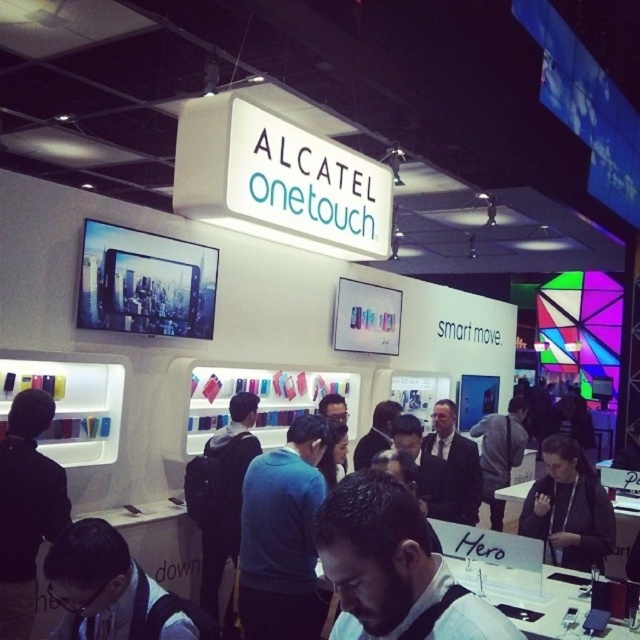
Question: Which of the following is the closest to the observer?

Choices:
 (A) (259, 474)
 (B) (19, 566)

Answer: (B)

Question: Does black fabric at center appear on the right side of black backpack at center?

Choices:
 (A) no
 (B) yes

Answer: (B)

Question: Does black matte phone at lower left appear over black backpack at center?

Choices:
 (A) yes
 (B) no

Answer: (A)

Question: Is the position of black matte phone at lower left more distant than that of black backpack at center?

Choices:
 (A) no
 (B) yes

Answer: (A)

Question: Which point is farther from the camera taking this photo?

Choices:
 (A) (248, 394)
 (B) (61, 504)

Answer: (A)

Question: Considering the real-world distances, which object is closest to the blue sweater at center?

Choices:
 (A) black backpack at center
 (B) black matte phone at lower left
 (C) black fabric jacket at center
 (D) black fabric at center

Answer: (A)